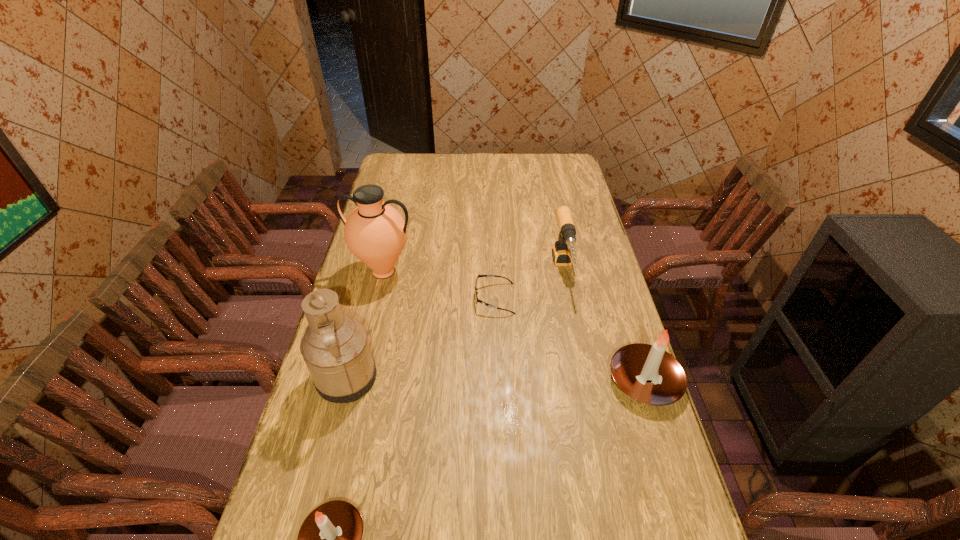
Locate an element on the screen. The image size is (960, 540). the farther candle is located at coordinates (x=647, y=373).

What are the coordinates of `the taller candle` in the screenshot? It's located at (647, 373).

This screenshot has height=540, width=960. In order to click on sunglasses in this screenshot , I will do `click(477, 300)`.

At what (x,y) coordinates should I click in order to perform the action: click on the shortest object. Please return your answer as a coordinate pair (x, y). Looking at the image, I should click on (477, 300).

Identify the location of the nearer pitcher. This screenshot has width=960, height=540. (335, 347).

Where is `the farther pitcher`? the farther pitcher is located at coordinates (375, 232).

I want to click on the fifth object from left to right, so click(561, 253).

Find the location of a particular element. Image resolution: width=960 pixels, height=540 pixels. drill is located at coordinates (561, 253).

The width and height of the screenshot is (960, 540). I want to click on blank space located on the left of the farther candle, so click(x=560, y=381).

Identify the location of free region located 0.350m on the front-facing side of the sunglasses. Image resolution: width=960 pixels, height=540 pixels. (372, 298).